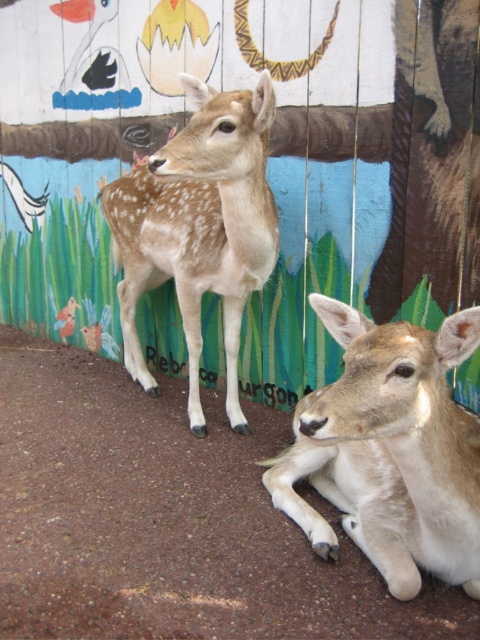
You are a zookeeper observing two deer in their enclosure. You notice the light brown fur at center and the spotted fur deer at center. Which of these has a smaller size?

The light brown fur at center has a smaller size compared to the spotted fur deer at center.

You are a zookeeper observing the two deer in the enclosure. You notice both have fur patterns. Which deer has the light brown fur at center positioned lower than the spotted fur deer at center?

The light brown fur at center is located below spotted fur deer at center, so the light brown fur at center is positioned lower than the spotted fur deer at center.